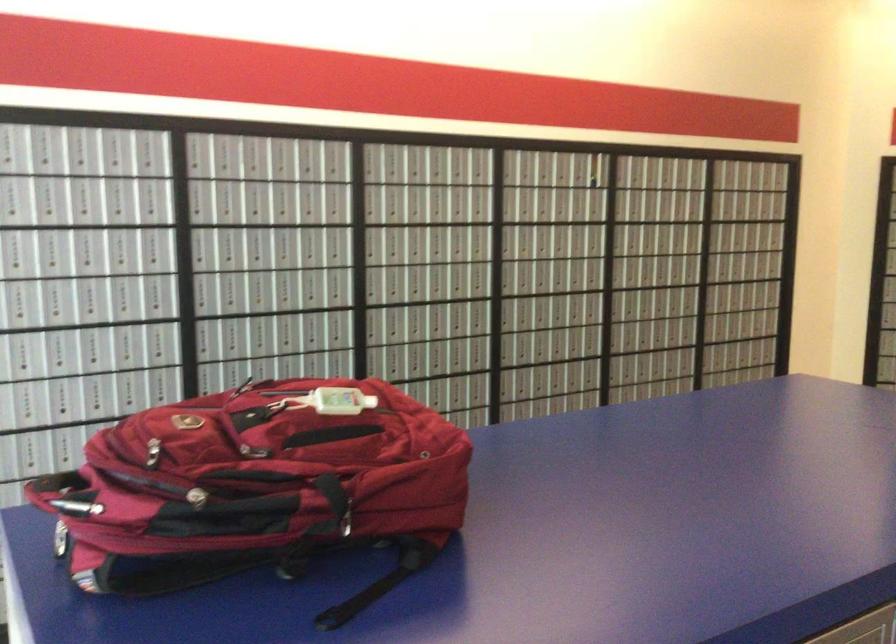
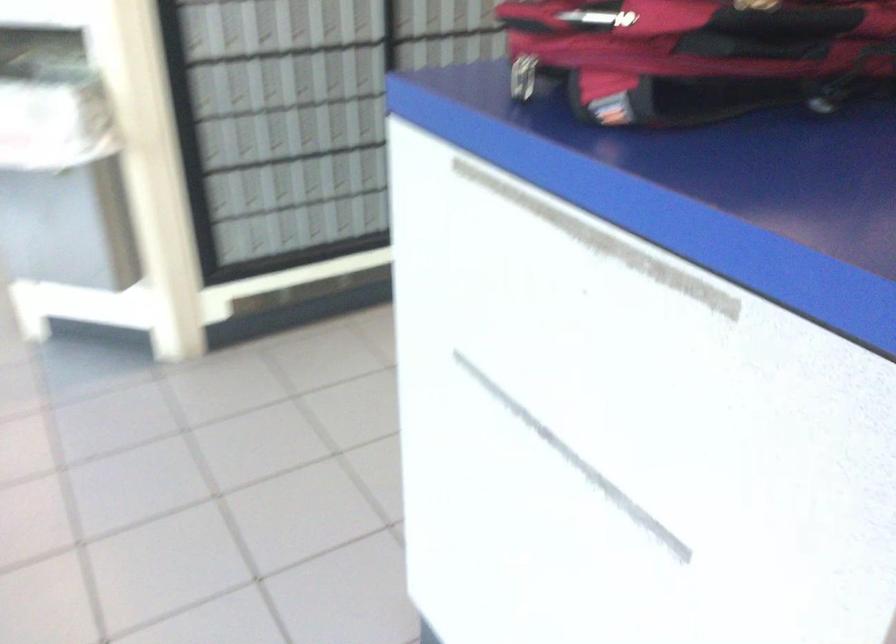
Question: The images are taken continuously from a first-person perspective. In which direction is your viewpoint rotating?

Choices:
 (A) Left
 (B) Right
 (C) Up
 (D) Down

Answer: (D)